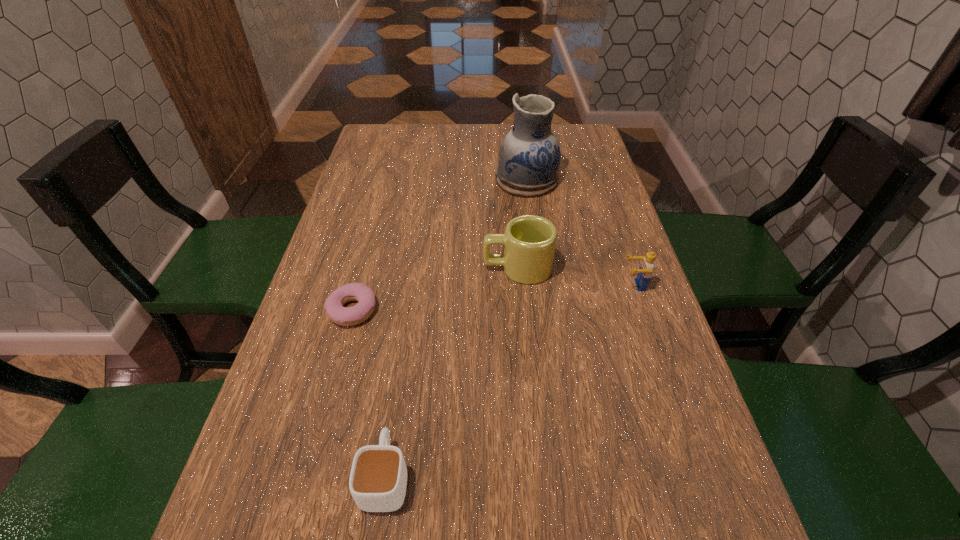
You are a GUI agent. You are given a task and a screenshot of the screen. Output one action in this format:
    pyautogui.click(x=<x>, y=<y>)
    Task: Click on the object at the left edge
    This screenshot has height=540, width=960.
    Given the screenshot: What is the action you would take?
    pyautogui.click(x=346, y=316)

Locate an element on the screen. pottery that is at the right edge is located at coordinates (529, 158).

At what (x,y) coordinates should I click in order to perform the action: click on Lego that is positioned at the right edge. Please return your answer as a coordinate pair (x, y). The width and height of the screenshot is (960, 540). Looking at the image, I should click on pyautogui.click(x=645, y=271).

You are a GUI agent. You are given a task and a screenshot of the screen. Output one action in this format:
    pyautogui.click(x=<x>, y=<y>)
    Task: Click on the vacant region at the far edge
    
    Given the screenshot: What is the action you would take?
    pyautogui.click(x=444, y=138)

At what (x,y) coordinates should I click in order to perform the action: click on free region at the left edge of the desktop. Please return your answer as a coordinate pair (x, y). The width and height of the screenshot is (960, 540). Looking at the image, I should click on (324, 286).

Identify the location of free space at the right edge of the desktop. (605, 178).

Identify the location of vacant area at the far left corner. (381, 139).

Image resolution: width=960 pixels, height=540 pixels. Identify the location of free space at the far right corner of the desktop. (553, 124).

Find the location of a particular element. free spot between the rightmost object and the tallest object is located at coordinates (580, 233).

Identify the location of free space that is in between the Lego and the farthest object. This screenshot has height=540, width=960. (580, 233).